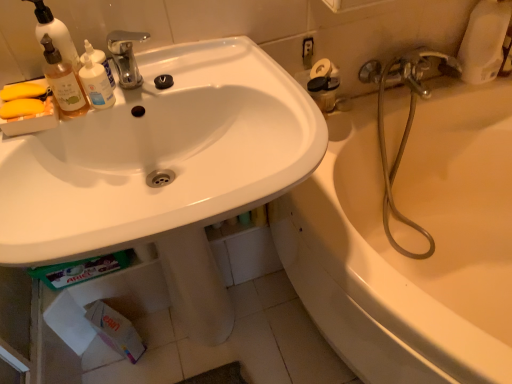
Locate an element on the screen. This screenshot has height=384, width=512. empty space that is to the right of white matte soap dispenser at upper left is located at coordinates (x=172, y=72).